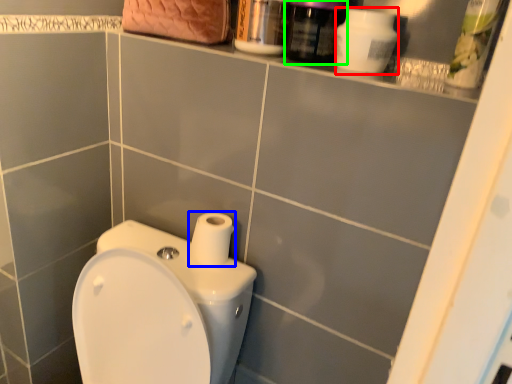
Question: Which object is positioned farthest from cleaning product (highlighted by a red box)? Select from toilet paper (highlighted by a blue box) and mouthwash (highlighted by a green box).

Choices:
 (A) toilet paper
 (B) mouthwash

Answer: (A)